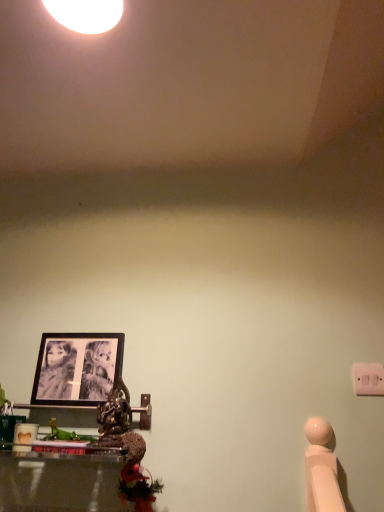
Question: Is white plastic light switch at right in front of or behind black matte picture frame at left in the image?

Choices:
 (A) front
 (B) behind

Answer: (A)

Question: Visually, is white plastic light switch at right positioned to the left or to the right of black matte picture frame at left?

Choices:
 (A) right
 (B) left

Answer: (A)

Question: Is white plastic light switch at right bigger or smaller than black matte picture frame at left?

Choices:
 (A) big
 (B) small

Answer: (B)

Question: Considering the relative positions of black matte picture frame at left and white plastic light switch at right in the image provided, is black matte picture frame at left to the left or to the right of white plastic light switch at right?

Choices:
 (A) right
 (B) left

Answer: (B)

Question: Looking at their shapes, would you say black matte picture frame at left is wider or thinner than white plastic light switch at right?

Choices:
 (A) thin
 (B) wide

Answer: (B)

Question: Considering the positions of point (84, 364) and point (357, 370), is point (84, 364) closer or farther from the camera than point (357, 370)?

Choices:
 (A) closer
 (B) farther

Answer: (B)

Question: In terms of size, does black matte picture frame at left appear bigger or smaller than white plastic light switch at right?

Choices:
 (A) small
 (B) big

Answer: (B)